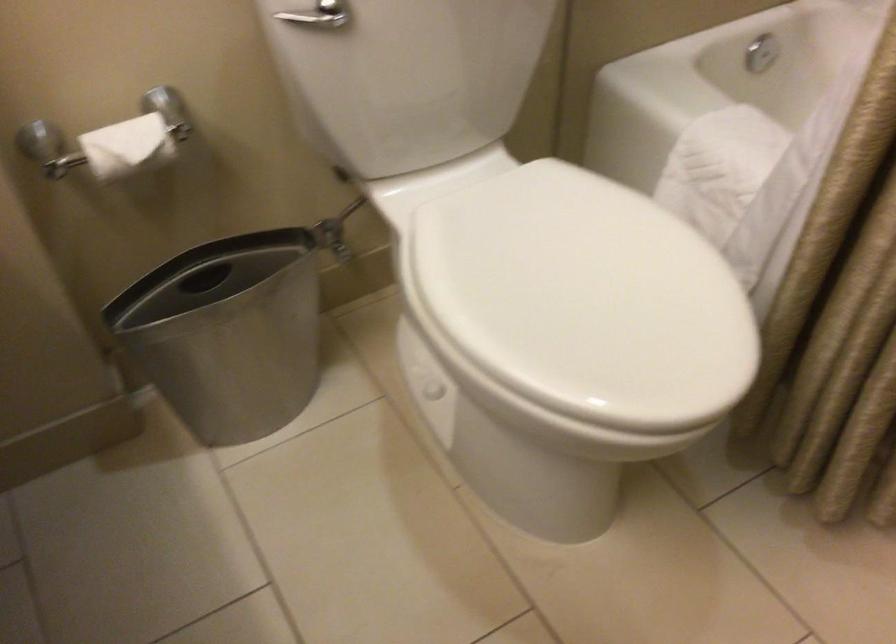
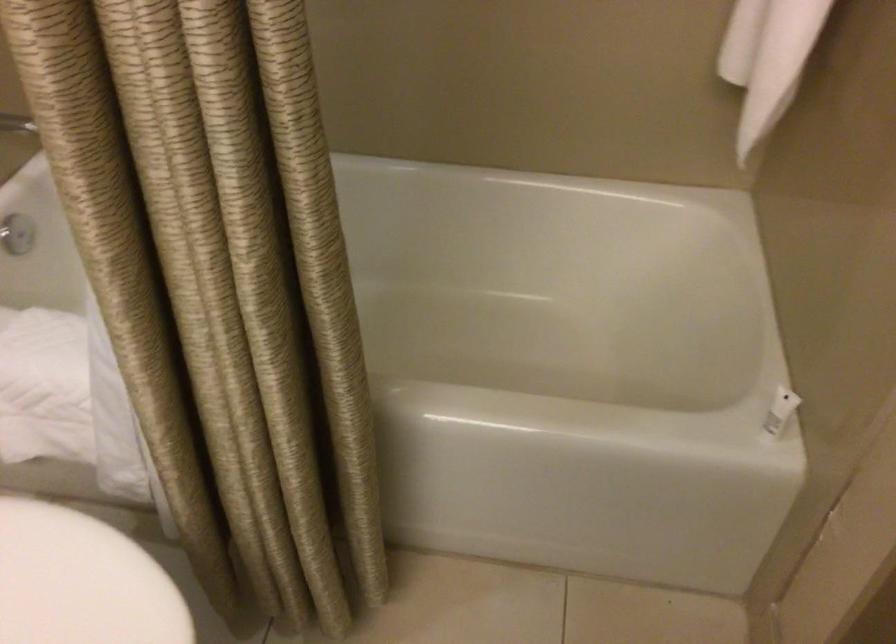
Question: Based on the continuous images, in which direction is the camera rotating? Reply with the corresponding letter.

Choices:
 (A) Left
 (B) Right
 (C) Up
 (D) Down

Answer: (B)